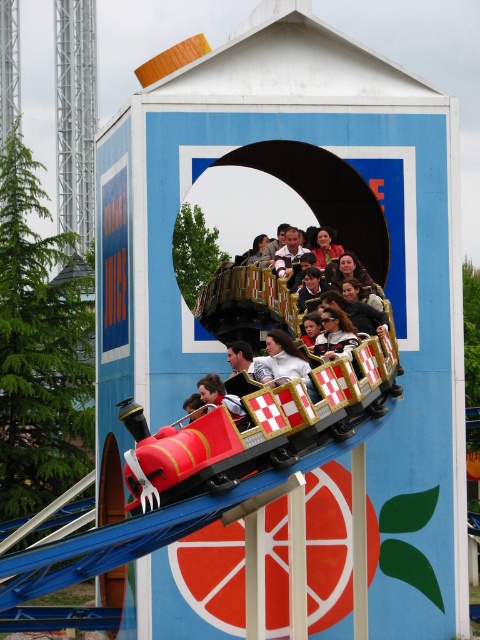
Question: Which object is farther from the camera taking this photo?

Choices:
 (A) matte black roller coaster car at center
 (B) metallic red roller coaster at center

Answer: (A)

Question: Which object appears closest to the camera in this image?

Choices:
 (A) matte black sunglasses at center
 (B) matte black roller coaster car at center
 (C) metallic red roller coaster at center

Answer: (C)

Question: Considering the relative positions of metallic red roller coaster at center and matte black roller coaster car at center in the image provided, where is metallic red roller coaster at center located with respect to matte black roller coaster car at center?

Choices:
 (A) right
 (B) left

Answer: (A)

Question: Which of the following is the farthest from the observer?

Choices:
 (A) matte black roller coaster car at center
 (B) metallic red roller coaster at center

Answer: (A)

Question: In this image, where is metallic red roller coaster at center located relative to matte black sunglasses at center?

Choices:
 (A) below
 (B) above

Answer: (A)

Question: Does metallic red roller coaster at center appear over matte black roller coaster car at center?

Choices:
 (A) no
 (B) yes

Answer: (A)